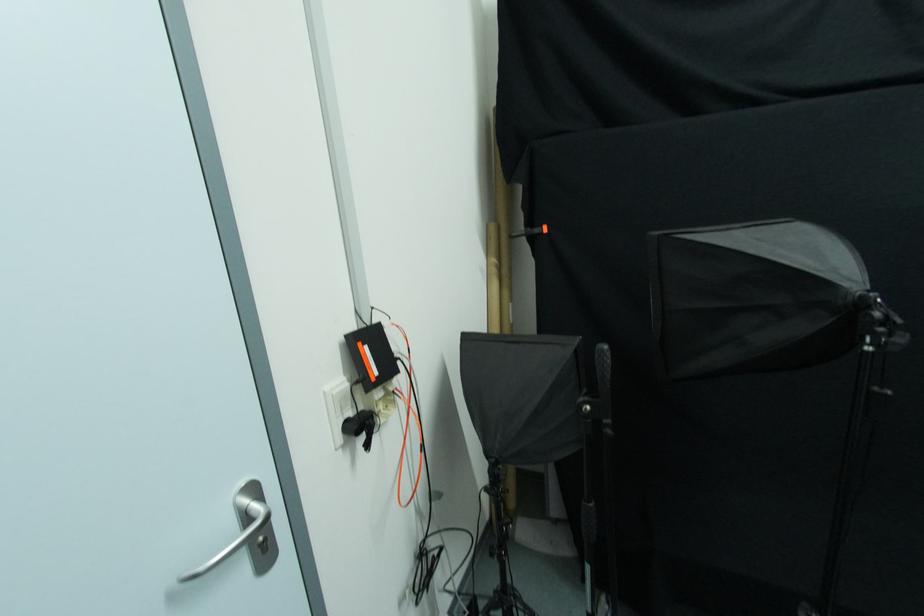
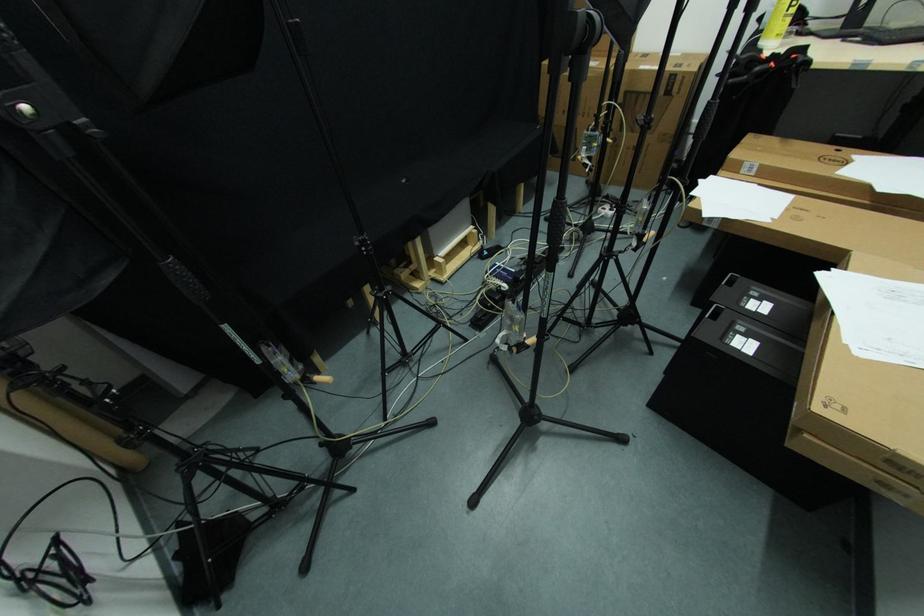
The first image is from the beginning of the video and the second image is from the end. How did the camera likely rotate when shooting the video?

The camera's rotation is toward right-down.